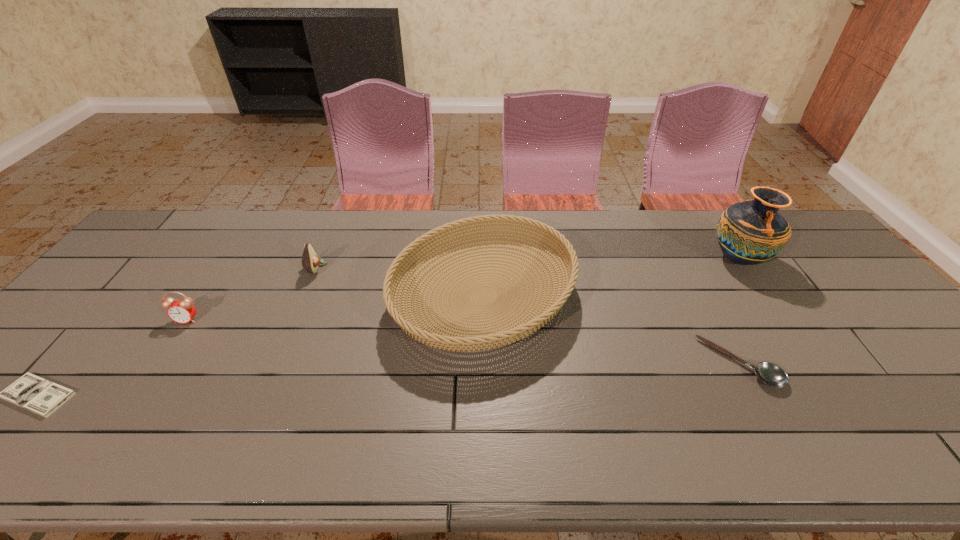
The width and height of the screenshot is (960, 540). What are the coordinates of `pottery` in the screenshot? It's located at (751, 232).

Where is `the fourth object from right to left`? the fourth object from right to left is located at coordinates 310,260.

Identify the location of the fourth object from left to right. (498, 332).

Find the location of `the fifth object from right to left`. the fifth object from right to left is located at coordinates (182, 311).

This screenshot has width=960, height=540. Identify the location of the third shortest object. point(182,311).

The image size is (960, 540). I want to click on ladle, so click(770, 374).

Locate an element on the screen. The image size is (960, 540). vacant region located on the front of the tallest object is located at coordinates (767, 301).

Image resolution: width=960 pixels, height=540 pixels. I want to click on free space located on the seed side of the fourth object from right to left, so click(x=372, y=268).

You are a GUI agent. You are given a task and a screenshot of the screen. Output one action in this format:
    pyautogui.click(x=<x>, y=<y>)
    Task: Click on the blank area located 0.180m on the left of the basket
    This screenshot has height=540, width=960.
    Given the screenshot: What is the action you would take?
    pyautogui.click(x=328, y=297)

Where is `free space located on the clock face of the alarm clock`? free space located on the clock face of the alarm clock is located at coordinates (161, 358).